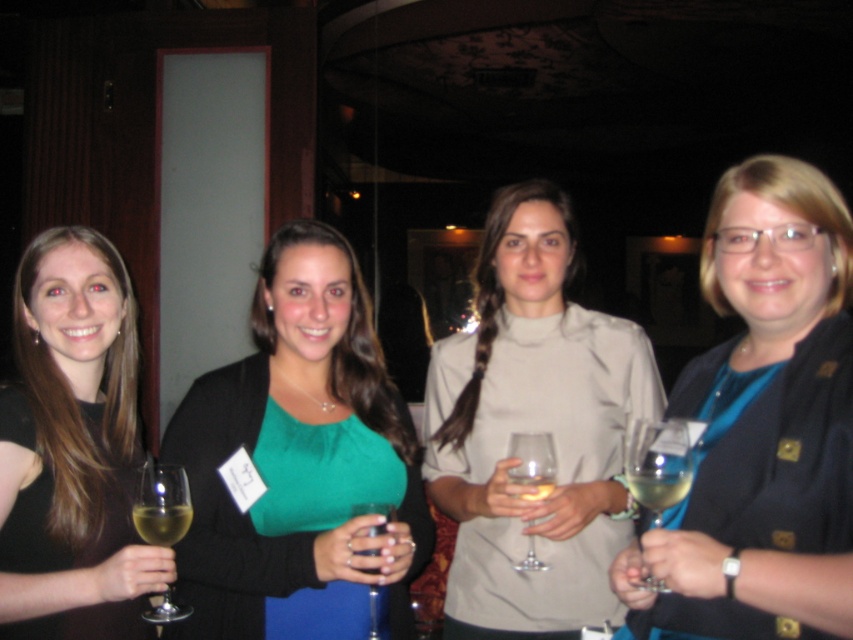
You are a photographer at the event and want to capture a closeup of the blue fabric shirt at center without the translucent glass at lower left appearing in the frame. Given their sizes, is this feasible?

The blue fabric shirt at center has a larger width than the translucent glass at lower left, so it is possible to frame the photo to focus on the blue fabric shirt at center while excluding the translucent glass at lower left.

You are a photographer at a social event and need to capture a closeup shot of the clear glass wine at center without including the matte beige blouse at center in the frame. Given their positions and sizes, is this possible?

The matte beige blouse at center is wider than the clear glass wine at center, so it might be challenging to frame the clear glass wine at center without including the blouse if they are positioned closely together at the center. Adjusting the camera angle or zoom could help isolate the wine glass.